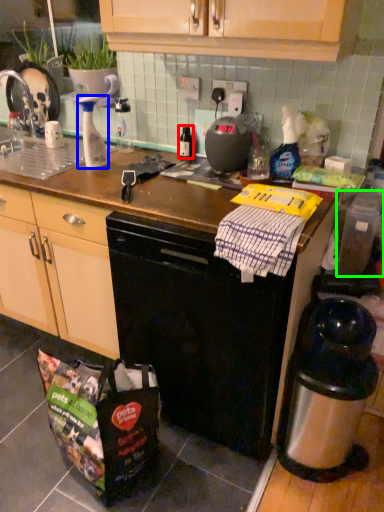
Question: Which object is the closest to the bottle (highlighted by a red box)? Choose among these: bottle (highlighted by a blue box) or appliance (highlighted by a green box).

Choices:
 (A) bottle
 (B) appliance

Answer: (A)